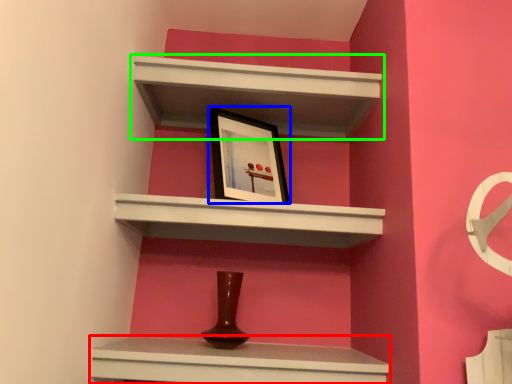
Question: Which object is positioned farthest from shelf (highlighted by a red box)? Select from picture frame (highlighted by a blue box) and shelf (highlighted by a green box).

Choices:
 (A) picture frame
 (B) shelf

Answer: (B)